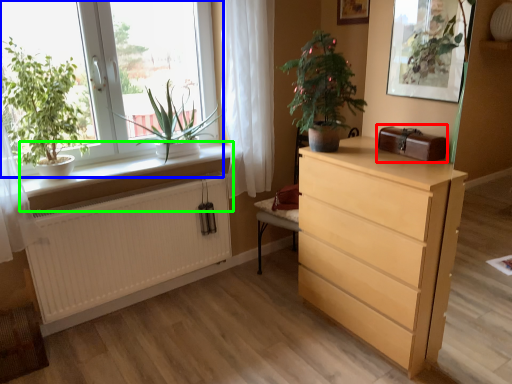
Question: Which object is positioned closest to window box (highlighted by a red box)? Select from window (highlighted by a blue box) and window sill (highlighted by a green box).

Choices:
 (A) window
 (B) window sill

Answer: (B)